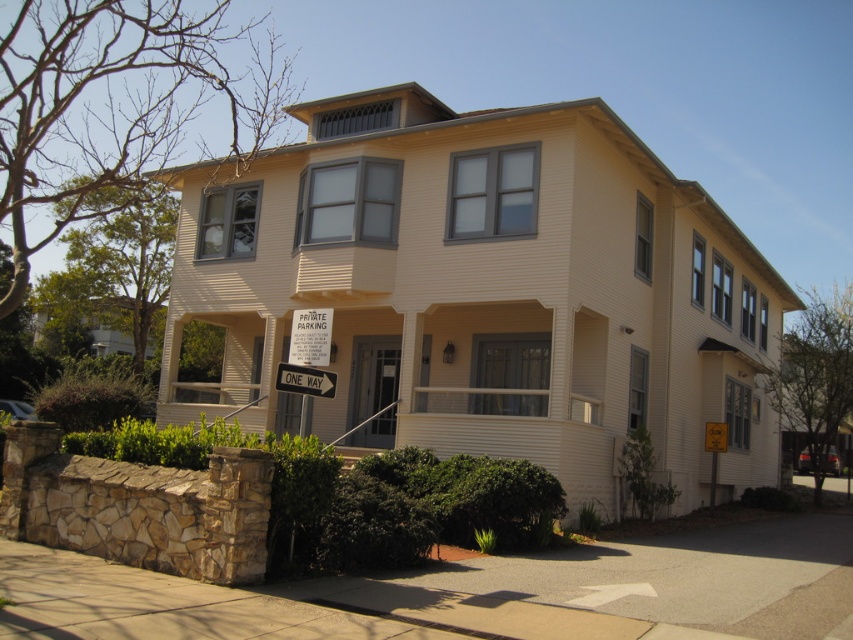
Question: Which object is farther from the camera taking this photo?

Choices:
 (A) white plastic one way sign at center
 (B) white painted wood trim at upper center

Answer: (B)

Question: From the image, what is the correct spatial relationship of white painted wood trim at upper center in relation to white plastic one way sign at center?

Choices:
 (A) left
 (B) right

Answer: (A)

Question: Is white painted wood trim at upper center positioned at the back of white plastic one way sign at center?

Choices:
 (A) yes
 (B) no

Answer: (A)

Question: Can you confirm if white painted wood trim at upper center is thinner than white plastic one way sign at center?

Choices:
 (A) no
 (B) yes

Answer: (A)

Question: Which point is closer to the camera taking this photo?

Choices:
 (A) (323, 378)
 (B) (595, 180)

Answer: (A)